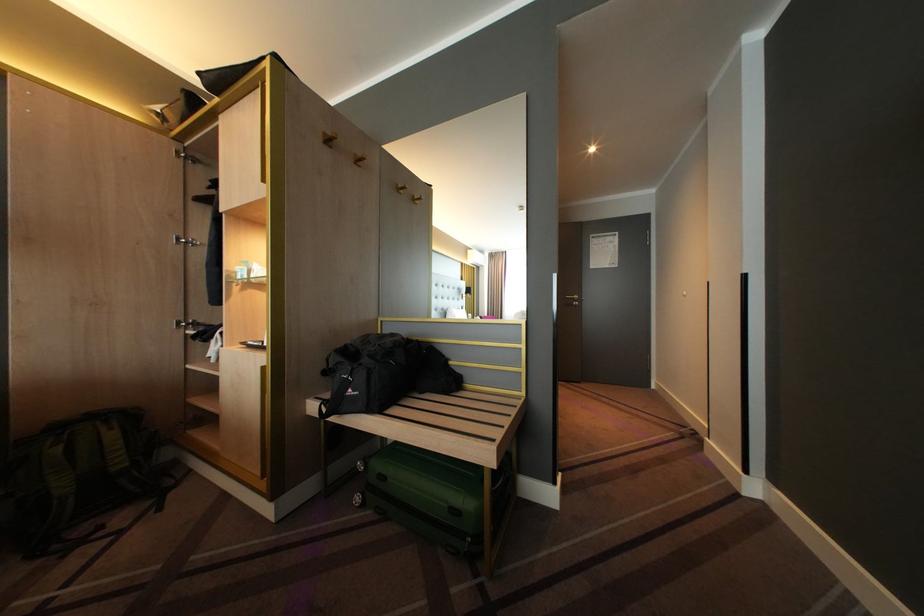
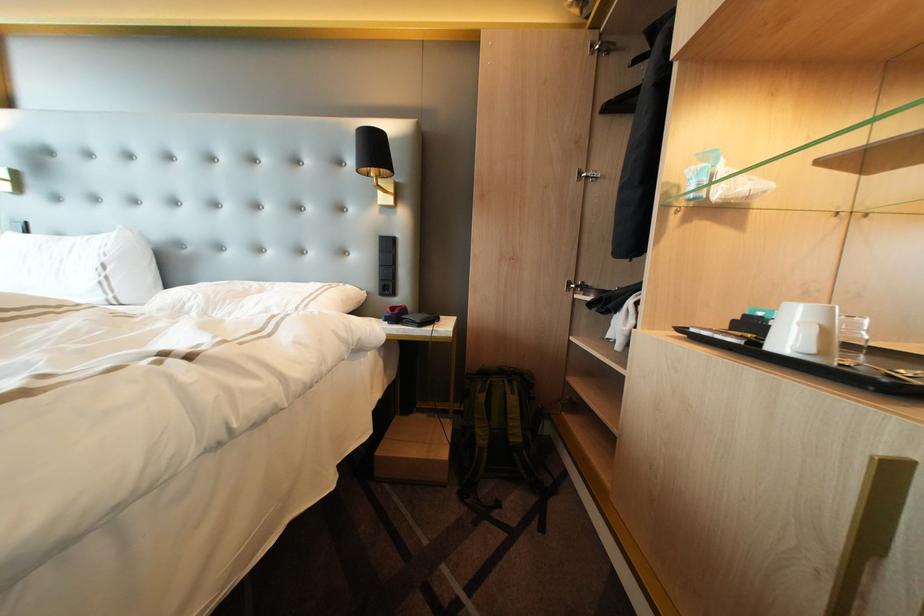
In the second image, find the point that corresponds to (x=124, y=430) in the first image.

(525, 394)